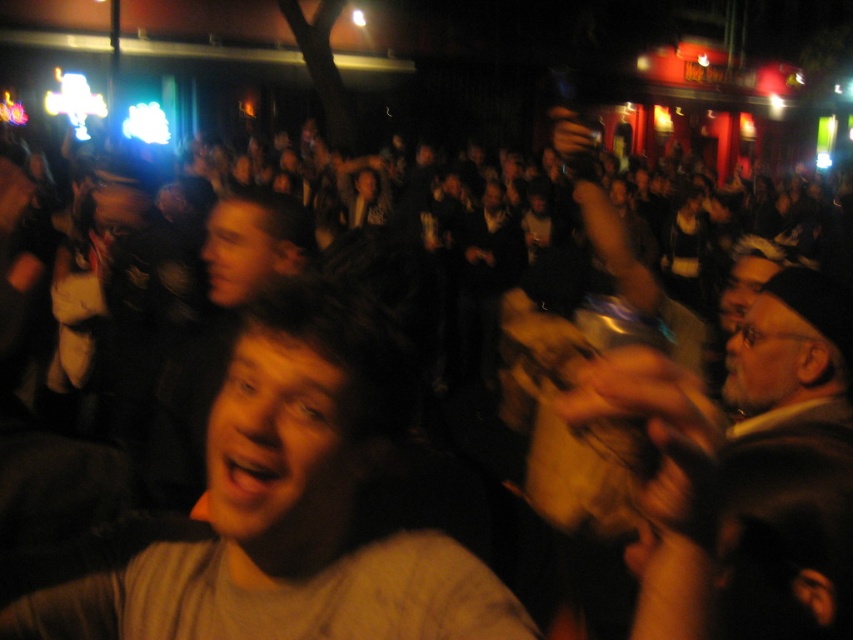
You are a photographer trying to capture a candid shot of two people wearing gray cotton shirt at center and gray wool sweater at center. The minimum focusing distance for your camera is 16 inches. Will you be able to take a clear photo of both individuals without moving closer?

The gray cotton shirt at center and gray wool sweater at center are 15.97 inches apart from each other, which is slightly less than the camera minimum focusing distance of 16 inches. Therefore, the camera may struggle to focus on both individuals clearly without moving closer.

You are a photographer at the event and want to capture both the gray cotton shirt at center and the gray wool sweater at center in a single shot. Which one should you focus on first to ensure it appears sharp in the photo?

The gray cotton shirt at center is located below the gray wool sweater at center. Since the gray wool sweater at center is higher up, you should focus on it first as it will be closer to the camera, ensuring both appear sharp.